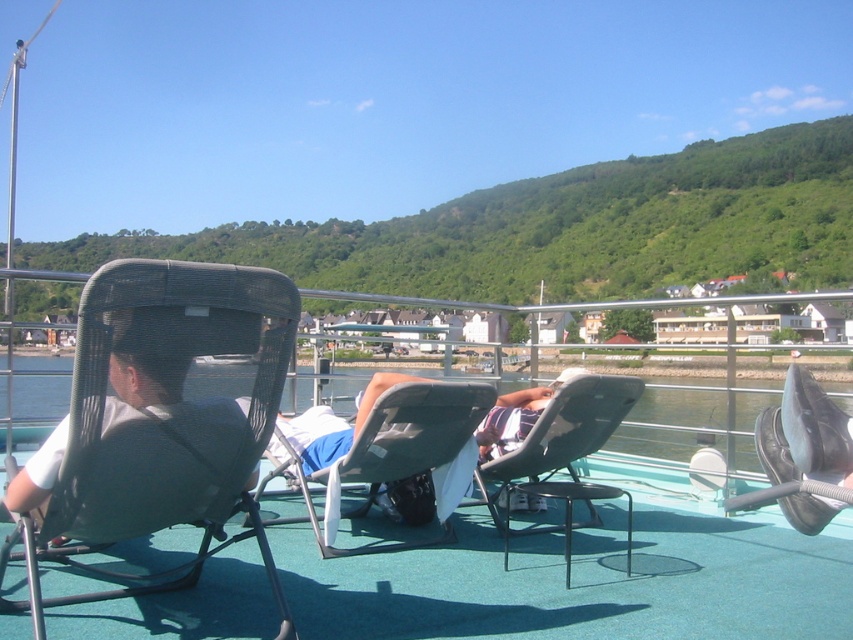
What do you see at coordinates (566, 454) in the screenshot?
I see `matte black chair at center` at bounding box center [566, 454].

Measure the distance between matte black chair at center and camera.

9.02 feet

Locate an element on the screen. matte black chair at center is located at coordinates (566, 454).

Locate an element on the screen. The height and width of the screenshot is (640, 853). matte black chair at center is located at coordinates (566, 454).

Can you confirm if matte black chair at left is smaller than matte black chair at center?

Actually, matte black chair at left might be larger than matte black chair at center.

Is point (225, 349) farther from camera compared to point (508, 467)?

No, (225, 349) is in front of (508, 467).

Which is in front, point (282, 596) or point (593, 508)?

Point (282, 596) is in front.

Where is `matte black chair at left`? The width and height of the screenshot is (853, 640). matte black chair at left is located at coordinates (160, 417).

Is point (318, 461) positioned behind point (500, 433)?

That is False.

Where is `blue fabric shorts at center`? The height and width of the screenshot is (640, 853). blue fabric shorts at center is located at coordinates (334, 424).